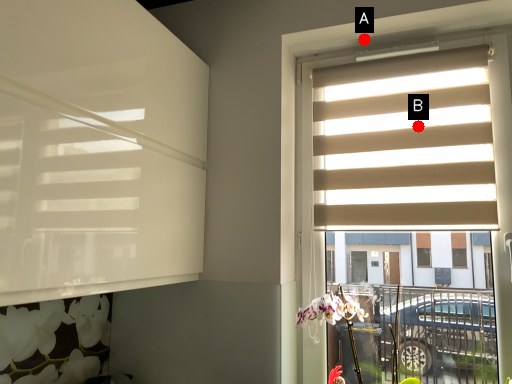
Question: Two points are circled on the image, labeled by A and B beside each circle. Which of the following is the farthest from the observer?

Choices:
 (A) A is further
 (B) B is further

Answer: (A)